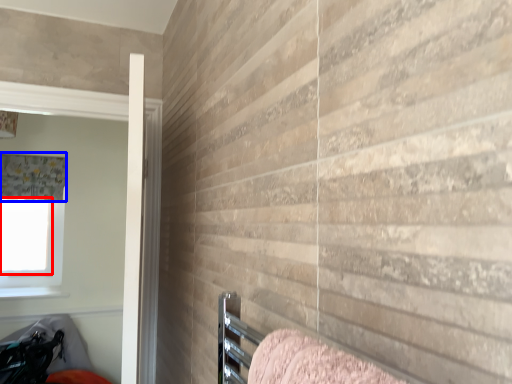
Question: Among these objects, which one is farthest to the camera, window screen (highlighted by a red box) or curtain (highlighted by a blue box)?

Choices:
 (A) window screen
 (B) curtain

Answer: (A)